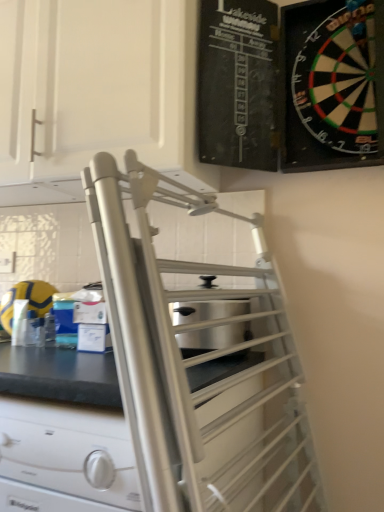
Question: Considering the relative sizes of stainless steel toaster at center and satin silver drawer at center in the image provided, is stainless steel toaster at center thinner than satin silver drawer at center?

Choices:
 (A) yes
 (B) no

Answer: (A)

Question: Are stainless steel toaster at center and satin silver drawer at center making contact?

Choices:
 (A) no
 (B) yes

Answer: (A)

Question: From the image's perspective, does stainless steel toaster at center appear higher than satin silver drawer at center?

Choices:
 (A) no
 (B) yes

Answer: (B)

Question: Does stainless steel toaster at center appear on the left side of satin silver drawer at center?

Choices:
 (A) yes
 (B) no

Answer: (B)

Question: From a real-world perspective, is stainless steel toaster at center on top of satin silver drawer at center?

Choices:
 (A) yes
 (B) no

Answer: (A)

Question: Considering their positions, is stainless steel toaster at center located in front of or behind black plastic dartboard at upper right, the second cabinetry viewed from the left?

Choices:
 (A) front
 (B) behind

Answer: (B)

Question: Is stainless steel toaster at center inside the boundaries of black plastic dartboard at upper right, the first cabinetry positioned from the right, or outside?

Choices:
 (A) outside
 (B) inside

Answer: (A)

Question: Is stainless steel toaster at center bigger or smaller than black plastic dartboard at upper right, the first cabinetry positioned from the right?

Choices:
 (A) big
 (B) small

Answer: (B)

Question: From a real-world perspective, is stainless steel toaster at center physically located above or below black plastic dartboard at upper right, the second cabinetry viewed from the left?

Choices:
 (A) below
 (B) above

Answer: (A)

Question: Is white matte cabinet at upper left, which is the 2th cabinetry from right to left, taller or shorter than black plastic dartboard at upper right, the first cabinetry positioned from the right?

Choices:
 (A) short
 (B) tall

Answer: (B)

Question: Is white matte cabinet at upper left, which is the 2th cabinetry from right to left, bigger or smaller than black plastic dartboard at upper right, the second cabinetry viewed from the left?

Choices:
 (A) big
 (B) small

Answer: (A)

Question: From the image's perspective, is white matte cabinet at upper left, which is the 2th cabinetry from right to left, above or below black plastic dartboard at upper right, the first cabinetry positioned from the right?

Choices:
 (A) below
 (B) above

Answer: (B)

Question: Is white matte cabinet at upper left, placed as the first cabinetry when sorted from left to right, to the left or to the right of black plastic dartboard at upper right, the second cabinetry viewed from the left, in the image?

Choices:
 (A) left
 (B) right

Answer: (A)

Question: Is satin silver drawer at center bigger or smaller than stainless steel toaster at center?

Choices:
 (A) big
 (B) small

Answer: (A)

Question: Is satin silver drawer at center spatially inside stainless steel toaster at center, or outside of it?

Choices:
 (A) outside
 (B) inside

Answer: (A)